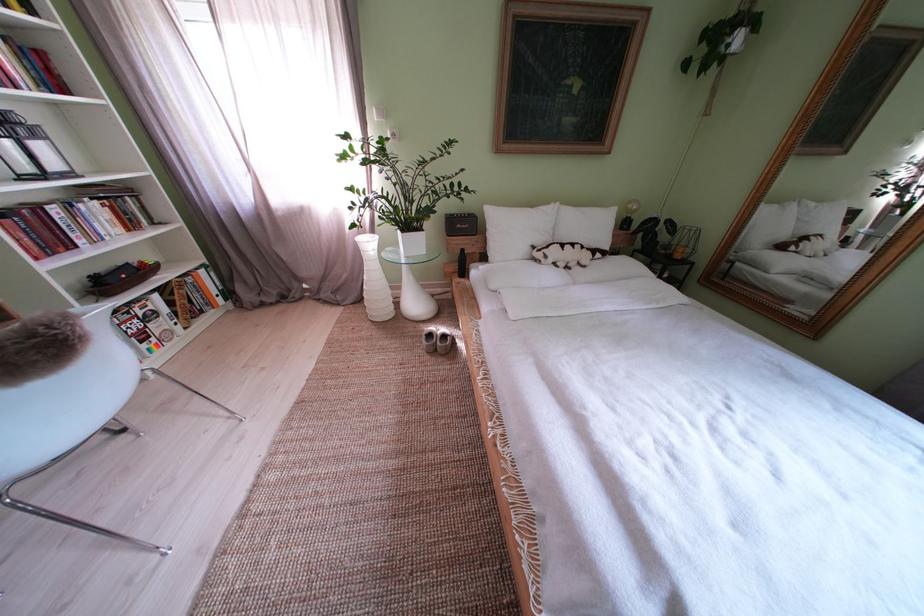
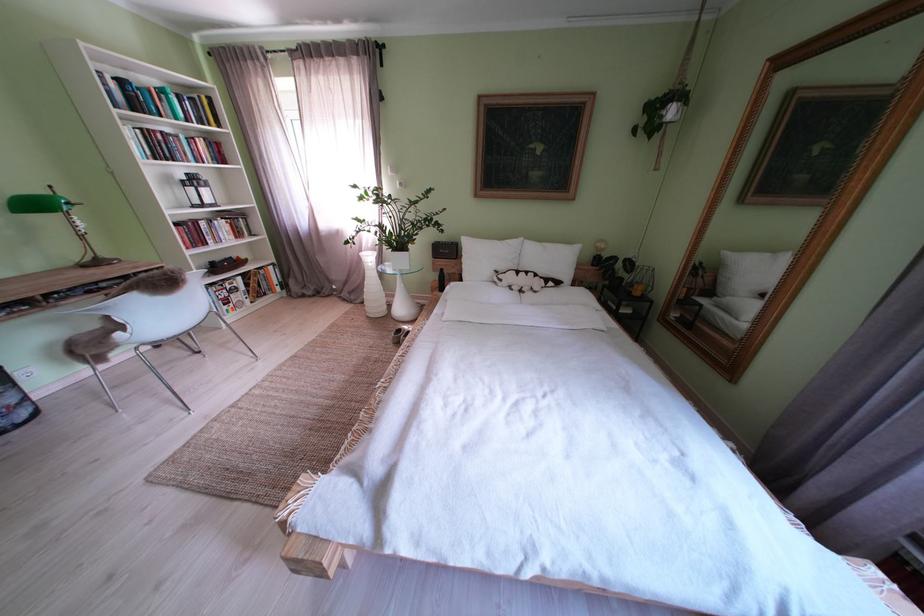
Locate, in the second image, the point that corresponds to point (556, 262) in the first image.

(512, 285)